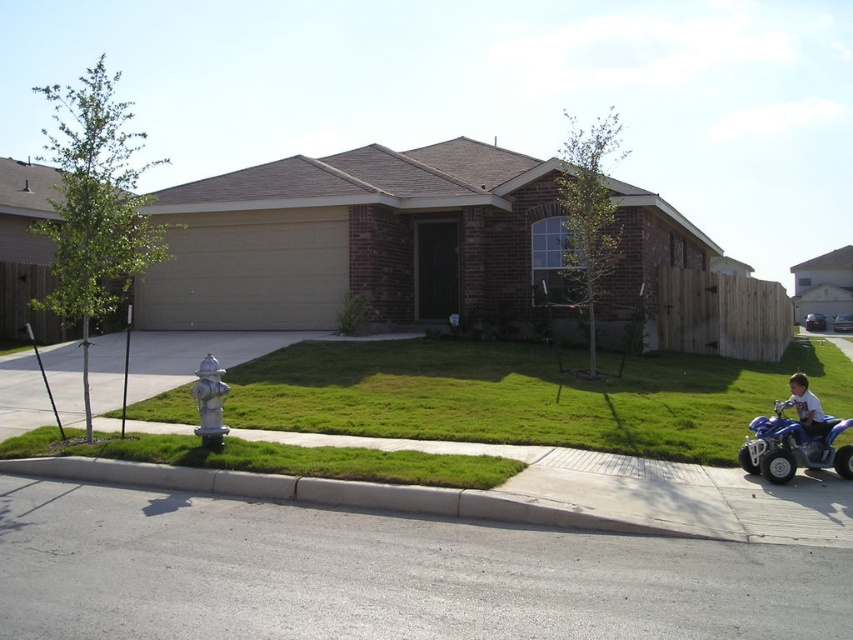
From the picture: Is blue plastic quad bike at lower right closer to camera compared to white matte toy at lower right?

That is True.

Who is more forward, (793, 426) or (793, 385)?

Point (793, 426)

This screenshot has height=640, width=853. I want to click on blue plastic quad bike at lower right, so click(x=793, y=445).

Does silver metallic fire hydrant at lower left have a greater width compared to white matte toy at lower right?

Indeed, silver metallic fire hydrant at lower left has a greater width compared to white matte toy at lower right.

Can you confirm if silver metallic fire hydrant at lower left is positioned above white matte toy at lower right?

Yes.

Image resolution: width=853 pixels, height=640 pixels. Describe the element at coordinates (209, 403) in the screenshot. I see `silver metallic fire hydrant at lower left` at that location.

The image size is (853, 640). Identify the location of silver metallic fire hydrant at lower left. (209, 403).

Between green grass at center and green grass at lower center, which one appears on the right side from the viewer's perspective?

green grass at center

Which is in front, point (614, 356) or point (393, 468)?

Point (393, 468)

Is point (416, 392) closer to camera compared to point (426, 468)?

That is False.

Find the location of a particular element. green grass at center is located at coordinates (524, 396).